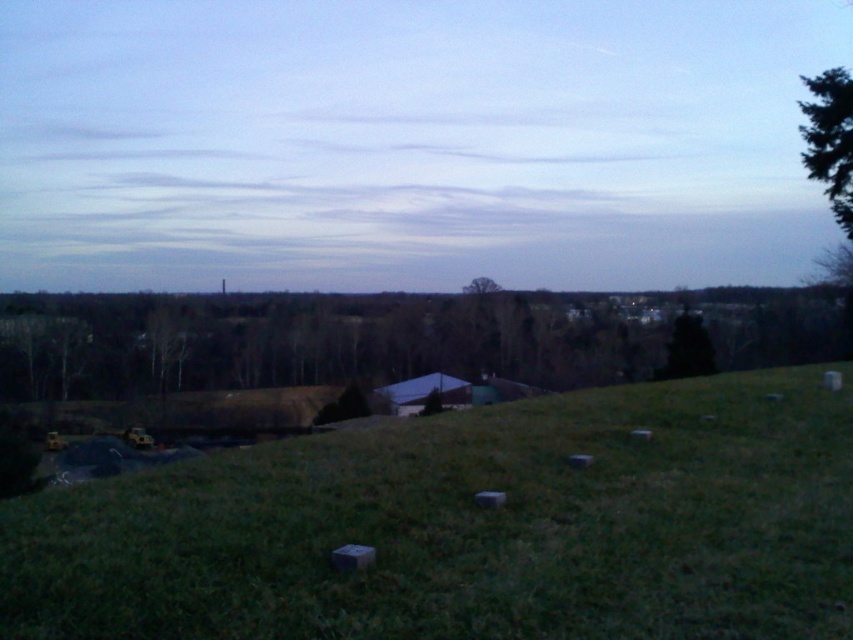
Question: Which point is farther to the camera?

Choices:
 (A) (126, 534)
 (B) (485, 218)

Answer: (B)

Question: Which of these objects is positioned closest to the green grassy hill at lower center?

Choices:
 (A) green textured tree at upper right
 (B) green leafy tree at center
 (C) blue sky at upper center

Answer: (A)

Question: Does blue sky at upper center come in front of green grassy hill at lower center?

Choices:
 (A) no
 (B) yes

Answer: (A)

Question: Is the position of blue sky at upper center less distant than that of green grassy hill at lower center?

Choices:
 (A) no
 (B) yes

Answer: (A)

Question: Which point is closer to the camera?

Choices:
 (A) (479, 291)
 (B) (509, 19)
 (C) (839, 188)

Answer: (C)

Question: Does green grassy hill at lower center appear under green leafy tree at center?

Choices:
 (A) yes
 (B) no

Answer: (A)